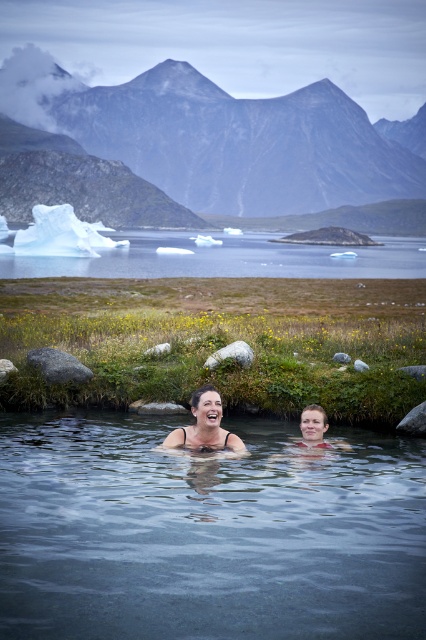
Question: Which of the following is the closest to the observer?

Choices:
 (A) (330, 605)
 (B) (190, 432)
 (C) (319, 269)
 (D) (238, 189)

Answer: (A)

Question: Which is farther from the smooth skin woman at center?

Choices:
 (A) white icebergs at upper left
 (B) clear water at center
 (C) smooth skin couple at center
 (D) gray rock at upper center

Answer: (D)

Question: In this image, where is white icebergs at upper left located relative to smooth skin woman at center?

Choices:
 (A) left
 (B) right

Answer: (B)

Question: Can you confirm if clear water at center is thinner than smooth skin couple at center?

Choices:
 (A) yes
 (B) no

Answer: (B)

Question: Which point is closer to the camera?

Choices:
 (A) gray rock at upper center
 (B) clear water at center
 (C) smooth skin woman at center

Answer: (B)

Question: Does white icebergs at upper left appear under smooth skin couple at center?

Choices:
 (A) no
 (B) yes

Answer: (A)